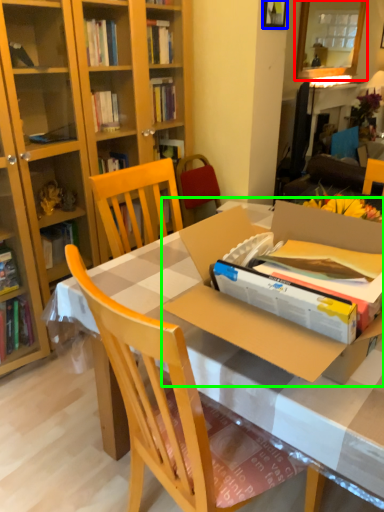
Question: Which object is the farthest from mirror (highlighted by a red box)? Choose among these: picture frame (highlighted by a blue box) or cardboard box (highlighted by a green box).

Choices:
 (A) picture frame
 (B) cardboard box

Answer: (B)